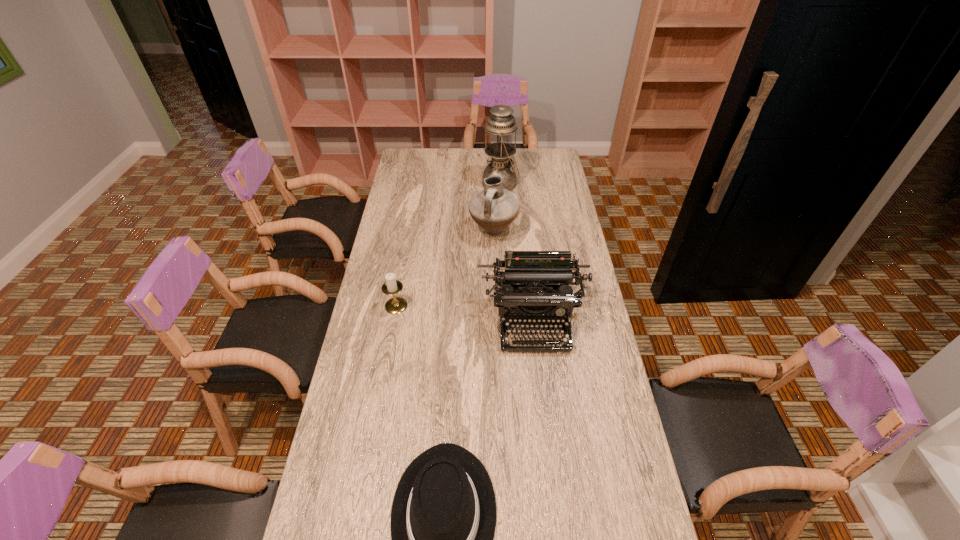
The width and height of the screenshot is (960, 540). I want to click on free space between the typewriter and the leftmost object, so click(x=465, y=314).

Select which object is the fourth closest to the oil lamp. Please provide its 2D coordinates. Your answer should be formatted as a tuple, i.e. [(x, y)], where the tuple contains the x and y coordinates of a point satisfying the conditions above.

[(443, 518)]

Point out which object is positioned as the second nearest to the fourth nearest object. Please provide its 2D coordinates. Your answer should be formatted as a tuple, i.e. [(x, y)], where the tuple contains the x and y coordinates of a point satisfying the conditions above.

[(534, 282)]

Find the location of a particular element. free space that satisfies the following two spatial constraints: 1. on the back side of the oil lamp; 2. on the left side of the second shortest object is located at coordinates (418, 184).

You are a GUI agent. You are given a task and a screenshot of the screen. Output one action in this format:
    pyautogui.click(x=<x>, y=<y>)
    Task: Click on the free region that satisfies the following two spatial constraints: 1. on the back side of the tallest object; 2. on the left side of the candle holder
    
    Given the screenshot: What is the action you would take?
    pyautogui.click(x=418, y=184)

In order to click on blank area in the image that satisfies the following two spatial constraints: 1. on the back side of the oil lamp; 2. on the right side of the candle holder in this screenshot , I will do `click(418, 184)`.